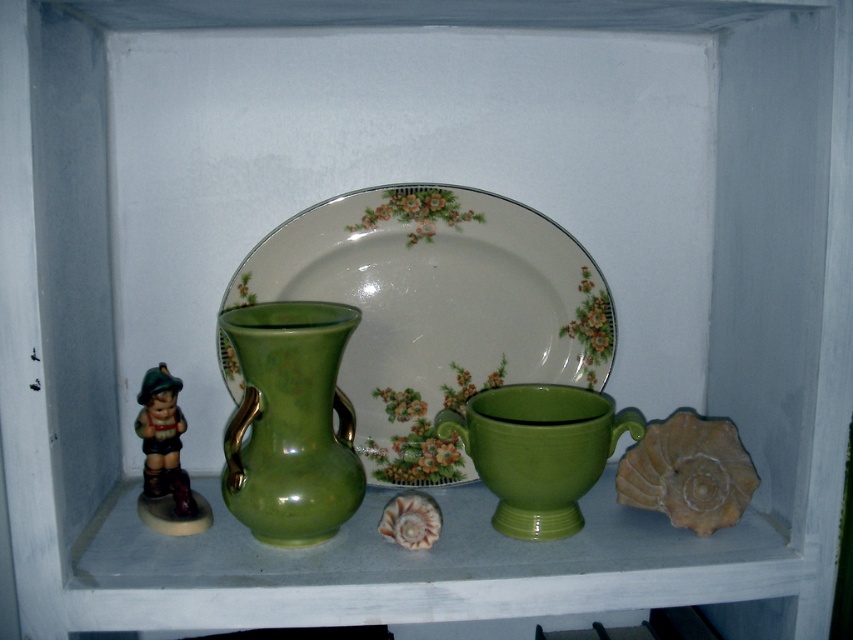
Which of these two, porcelain floral platter at center or matte ceramic figurine at left, stands taller?

With more height is porcelain floral platter at center.

Is porcelain floral platter at center thinner than matte ceramic figurine at left?

No, porcelain floral platter at center is not thinner than matte ceramic figurine at left.

Where is `porcelain floral platter at center`? porcelain floral platter at center is located at coordinates (436, 310).

Measure the distance between porcelain floral platter at center and green glossy vase at center.

porcelain floral platter at center is 12.18 centimeters from green glossy vase at center.

Is porcelain floral platter at center taller than green glossy vase at center?

Correct, porcelain floral platter at center is much taller as green glossy vase at center.

Identify the location of porcelain floral platter at center. (436, 310).

Where is `porcelain floral platter at center`? porcelain floral platter at center is located at coordinates (436, 310).

Can you confirm if green glossy vase at center is thinner than matte ceramic figurine at left?

Incorrect, green glossy vase at center's width is not less than matte ceramic figurine at left's.

Can you confirm if green glossy vase at center is smaller than matte ceramic figurine at left?

Actually, green glossy vase at center might be larger than matte ceramic figurine at left.

The image size is (853, 640). I want to click on green glossy vase at center, so click(x=289, y=422).